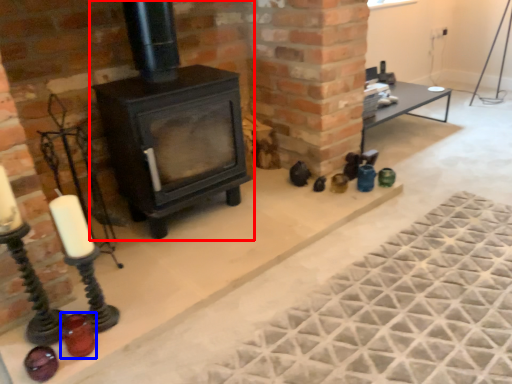
Question: Which object appears closest to the camera in this image, wood burning stove (highlighted by a red box) or candle holder (highlighted by a blue box)?

Choices:
 (A) wood burning stove
 (B) candle holder

Answer: (B)